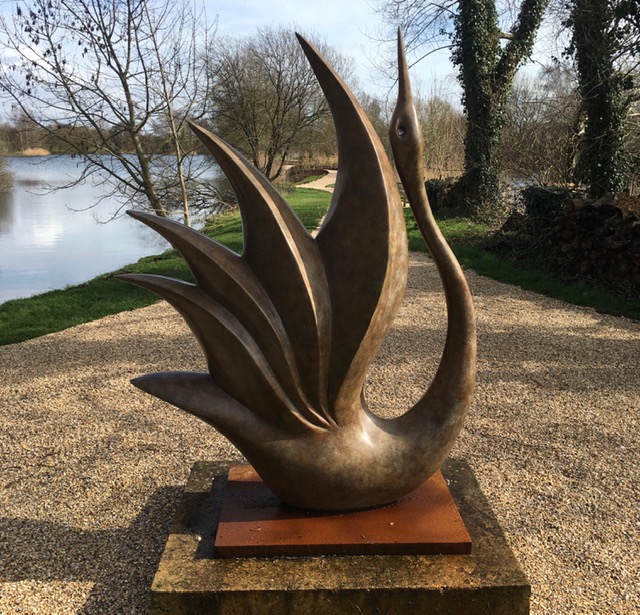
Locate an element on the screen. The height and width of the screenshot is (615, 640). sculpture's square stone base is located at coordinates (406, 574).